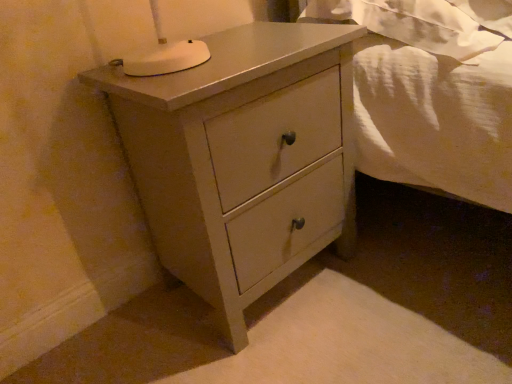
Question: Can matte gray chest of drawers at center be found inside white cotton sheet at upper right?

Choices:
 (A) no
 (B) yes

Answer: (A)

Question: Is white cotton sheet at upper right taller than matte gray chest of drawers at center?

Choices:
 (A) no
 (B) yes

Answer: (A)

Question: Is white cotton sheet at upper right turned away from matte gray chest of drawers at center?

Choices:
 (A) yes
 (B) no

Answer: (B)

Question: From the image's perspective, would you say white cotton sheet at upper right is shown under matte gray chest of drawers at center?

Choices:
 (A) yes
 (B) no

Answer: (B)

Question: Is white cotton sheet at upper right not within matte gray chest of drawers at center?

Choices:
 (A) yes
 (B) no

Answer: (A)

Question: Does white cotton sheet at upper right have a greater width compared to matte gray chest of drawers at center?

Choices:
 (A) yes
 (B) no

Answer: (A)

Question: Does matte gray chest of drawers at center have a larger size compared to white cotton sheet at upper right?

Choices:
 (A) no
 (B) yes

Answer: (B)

Question: Would you say matte gray chest of drawers at center is outside white cotton sheet at upper right?

Choices:
 (A) yes
 (B) no

Answer: (A)

Question: From a real-world perspective, does matte gray chest of drawers at center stand above white cotton sheet at upper right?

Choices:
 (A) yes
 (B) no

Answer: (B)

Question: Is matte gray chest of drawers at center further to camera compared to white cotton sheet at upper right?

Choices:
 (A) yes
 (B) no

Answer: (B)

Question: Are matte gray chest of drawers at center and white cotton sheet at upper right located far from each other?

Choices:
 (A) no
 (B) yes

Answer: (A)

Question: Would you say matte gray chest of drawers at center contains white cotton sheet at upper right?

Choices:
 (A) no
 (B) yes

Answer: (A)

Question: In terms of height, does matte gray chest of drawers at center look taller or shorter compared to white cotton sheet at upper right?

Choices:
 (A) tall
 (B) short

Answer: (A)